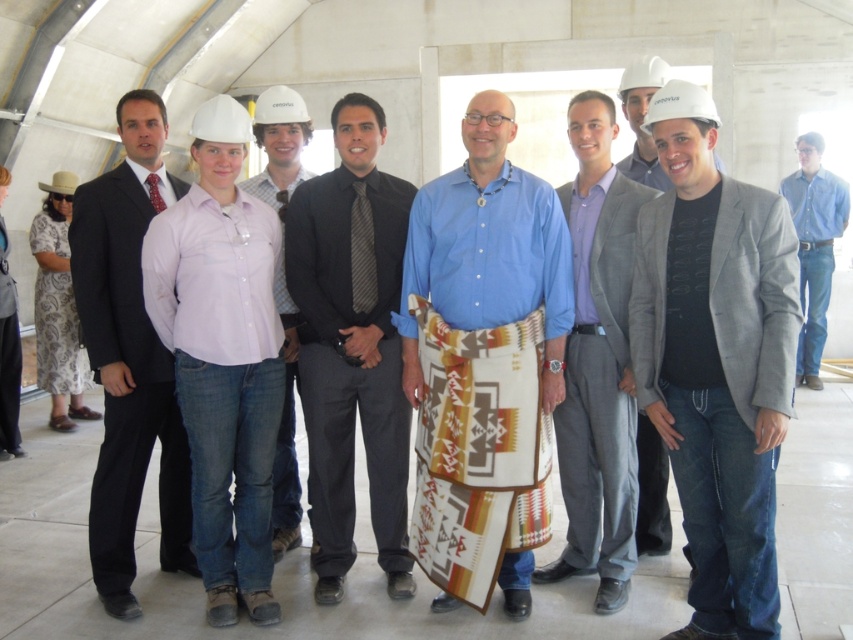
Which is in front, point (395, 458) or point (807, 246)?

Point (395, 458) is in front.

Is black smooth shirt at center positioned in front of blue denim jeans at right?

Yes, black smooth shirt at center is closer to the viewer.

Between point (335, 195) and point (793, 198), which one is positioned in front?

Point (335, 195) is more forward.

This screenshot has height=640, width=853. What are the coordinates of `black smooth shirt at center` in the screenshot? It's located at (351, 346).

How much distance is there between gray matte blazer at center and gray fabric at center?

gray matte blazer at center and gray fabric at center are 21.23 inches apart.

Which is below, gray matte blazer at center or gray fabric at center?

gray matte blazer at center

Locate an element on the screen. gray matte blazer at center is located at coordinates (717, 362).

Locate an element on the screen. gray matte blazer at center is located at coordinates (717, 362).

Consider the image. How distant is black smooth shirt at center from matte black suit at left?

black smooth shirt at center is 80.43 centimeters from matte black suit at left.

Is point (358, 294) closer to viewer compared to point (113, 579)?

No, (358, 294) is further to viewer.

Is point (299, 371) farther from camera compared to point (164, 560)?

No.

Image resolution: width=853 pixels, height=640 pixels. I want to click on black smooth shirt at center, so click(x=351, y=346).